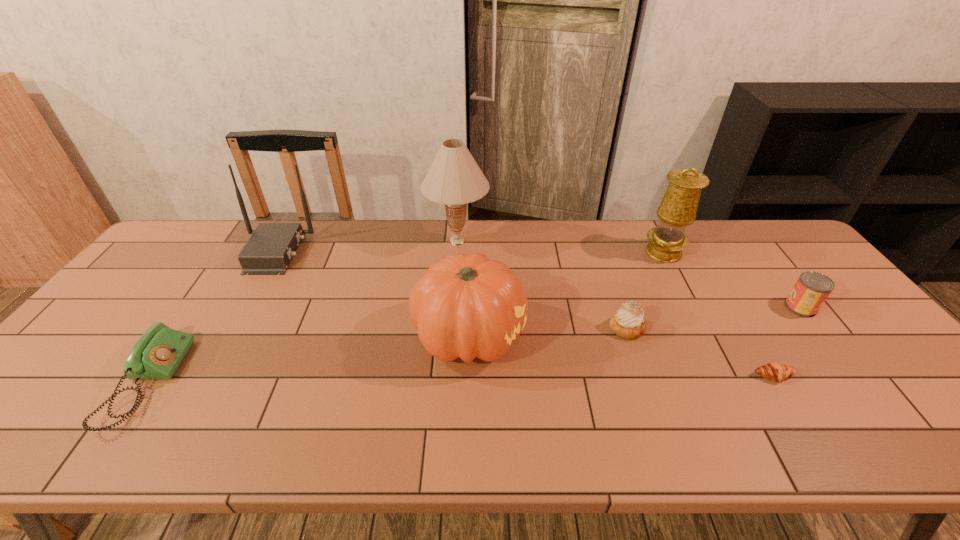
Find the location of a particular element. The height and width of the screenshot is (540, 960). oil lamp at the far edge is located at coordinates (678, 208).

At what (x,y) coordinates should I click in order to perform the action: click on router present at the far edge. Please return your answer as a coordinate pair (x, y). This screenshot has height=540, width=960. Looking at the image, I should click on (269, 250).

The height and width of the screenshot is (540, 960). What are the coordinates of `object present at the near edge` in the screenshot? It's located at (158, 353).

Find the location of `object positioned at the right edge`. object positioned at the right edge is located at coordinates (811, 290).

At what (x,y) coordinates should I click in order to perform the action: click on vacant space at the far edge of the desktop. Please return your answer as a coordinate pair (x, y). The image size is (960, 540). Looking at the image, I should click on (518, 241).

Where is `vacant region at the near edge of the desktop`? vacant region at the near edge of the desktop is located at coordinates (355, 444).

What are the coordinates of `free space at the left edge` in the screenshot? It's located at (172, 281).

Locate an element on the screen. Image resolution: width=960 pixels, height=540 pixels. free space at the right edge is located at coordinates (799, 320).

This screenshot has width=960, height=540. I want to click on free space at the far right corner, so click(744, 226).

Where is `vacant space in between the shortest object and the oil lamp`? The width and height of the screenshot is (960, 540). vacant space in between the shortest object and the oil lamp is located at coordinates (718, 314).